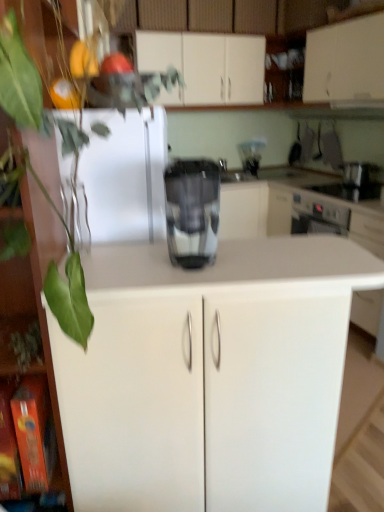
Describe the element at coordinates (40, 296) in the screenshot. I see `white matte cabinet at left, which is counted as the 1th cabinetry, starting from the front` at that location.

This screenshot has height=512, width=384. What are the coordinates of `green leafy plant at left` in the screenshot? It's located at (31, 93).

Describe the element at coordinates (251, 155) in the screenshot. The height and width of the screenshot is (512, 384). I see `metallic silver coffee maker at center` at that location.

How much space does metallic silver toaster at upper right, marked as the 2th appliance in a bottom-to-top arrangement, occupy vertically?

7.13 inches.

The width and height of the screenshot is (384, 512). In order to click on white matte cabinet at upper center, which is counted as the first cabinetry, starting from the back in this screenshot , I will do `click(205, 66)`.

Does metallic silver toaster at upper right, the 1th appliance in the top-to-bottom sequence, have a greater width compared to white matte cabinet at upper center, which is counted as the first cabinetry, starting from the back?

No.

From the image's perspective, which one is positioned higher, metallic silver toaster at upper right, marked as the 2th appliance in a bottom-to-top arrangement, or white matte cabinet at upper center, arranged as the fourth cabinetry when viewed from the front?

white matte cabinet at upper center, arranged as the fourth cabinetry when viewed from the front, appears higher in the image.

From a real-world perspective, is metallic silver toaster at upper right, marked as the 2th appliance in a bottom-to-top arrangement, positioned under white matte cabinet at upper center, which is counted as the first cabinetry, starting from the back, based on gravity?

Yes, from a real-world perspective, metallic silver toaster at upper right, marked as the 2th appliance in a bottom-to-top arrangement, is beneath white matte cabinet at upper center, which is counted as the first cabinetry, starting from the back.

Which object is positioned more to the right, metallic silver toaster at upper right, the 1th appliance in the top-to-bottom sequence, or white matte cabinet at upper center, which is counted as the first cabinetry, starting from the back?

metallic silver toaster at upper right, the 1th appliance in the top-to-bottom sequence, is more to the right.

Considering the relative positions of black glass stove at upper right, the 2th appliance when ordered from top to bottom, and white matte cabinet at left, which is counted as the 1th cabinetry, starting from the front, in the image provided, is black glass stove at upper right, the 2th appliance when ordered from top to bottom, to the right of white matte cabinet at left, which is counted as the 1th cabinetry, starting from the front, from the viewer's perspective?

Yes.

Can you confirm if black glass stove at upper right, the first appliance from the bottom, is wider than white matte cabinet at left, which is counted as the 1th cabinetry, starting from the front?

Yes.

Does point (355, 195) lie behind point (68, 492)?

Yes, it is behind point (68, 492).

What's the angular difference between black glass stove at upper right, the 2th appliance when ordered from top to bottom, and white matte cabinet at left, which is counted as the 1th cabinetry, starting from the front,'s facing directions?

They differ by 74.4 degrees in their facing directions.

In terms of size, does metallic silver coffee maker at center appear bigger or smaller than white matte cabinet at left, the fourth cabinetry positioned from the back?

Considering their sizes, metallic silver coffee maker at center takes up less space than white matte cabinet at left, the fourth cabinetry positioned from the back.

Considering the sizes of metallic silver coffee maker at center and white matte cabinet at left, the fourth cabinetry positioned from the back, in the image, is metallic silver coffee maker at center wider or thinner than white matte cabinet at left, the fourth cabinetry positioned from the back,?

Clearly, metallic silver coffee maker at center has less width compared to white matte cabinet at left, the fourth cabinetry positioned from the back.

Would you say metallic silver coffee maker at center contains white matte cabinet at left, which is counted as the 1th cabinetry, starting from the front?

Definitely not — white matte cabinet at left, which is counted as the 1th cabinetry, starting from the front, is not inside metallic silver coffee maker at center.

From a real-world perspective, does metallic silver coffee maker at center stand above white matte cabinet at left, the fourth cabinetry positioned from the back?

Yes, from a real-world perspective, metallic silver coffee maker at center is on top of white matte cabinet at left, the fourth cabinetry positioned from the back.

Relative to green leafy plant at left, is black glass stove at upper right, the 2th appliance when ordered from top to bottom, in front or behind?

Visually, black glass stove at upper right, the 2th appliance when ordered from top to bottom, is located behind green leafy plant at left.

Between black glass stove at upper right, the first appliance from the bottom, and green leafy plant at left, which one has smaller width?

green leafy plant at left.

Can you tell me how much metallic silver toaster at upper right, the 1th appliance in the top-to-bottom sequence, and white matte cabinet at upper center, which is counted as the second cabinetry, starting from the back, differ in facing direction?

The facing directions of metallic silver toaster at upper right, the 1th appliance in the top-to-bottom sequence, and white matte cabinet at upper center, which is counted as the second cabinetry, starting from the back, are 0.143 degrees apart.

From a real-world perspective, is metallic silver toaster at upper right, marked as the 2th appliance in a bottom-to-top arrangement, located beneath white matte cabinet at upper center, which is counted as the second cabinetry, starting from the back?

Yes, from a real-world perspective, metallic silver toaster at upper right, marked as the 2th appliance in a bottom-to-top arrangement, is below white matte cabinet at upper center, which is counted as the second cabinetry, starting from the back.

Is metallic silver toaster at upper right, the 1th appliance in the top-to-bottom sequence, wider or thinner than white matte cabinet at upper center, which is counted as the second cabinetry, starting from the back?

In the image, metallic silver toaster at upper right, the 1th appliance in the top-to-bottom sequence, appears to be more narrow than white matte cabinet at upper center, which is counted as the second cabinetry, starting from the back.

Considering the sizes of objects metallic silver toaster at upper right, marked as the 2th appliance in a bottom-to-top arrangement, and white matte cabinet at upper center, which is counted as the second cabinetry, starting from the back, in the image provided, who is shorter, metallic silver toaster at upper right, marked as the 2th appliance in a bottom-to-top arrangement, or white matte cabinet at upper center, which is counted as the second cabinetry, starting from the back,?

With less height is metallic silver toaster at upper right, marked as the 2th appliance in a bottom-to-top arrangement.

Which is closer to the camera, (198, 198) or (344, 199)?

Point (198, 198) is positioned closer to the camera compared to point (344, 199).

Find the location of a particular element. The height and width of the screenshot is (512, 384). home appliance that is below the black glass stove at upper right, the 2th appliance when ordered from top to bottom (from the image's perspective) is located at coordinates [192, 211].

In the scene shown: Do you think sleek metallic coffee maker at center is within black glass stove at upper right, the 2th appliance when ordered from top to bottom, or outside of it?

sleek metallic coffee maker at center lies outside black glass stove at upper right, the 2th appliance when ordered from top to bottom.

Is sleek metallic coffee maker at center bigger than black glass stove at upper right, the 2th appliance when ordered from top to bottom?

Actually, sleek metallic coffee maker at center might be smaller than black glass stove at upper right, the 2th appliance when ordered from top to bottom.

Does metallic silver coffee maker at center have a greater width compared to white matte cabinet at upper center, arranged as the fourth cabinetry when viewed from the front?

In fact, metallic silver coffee maker at center might be narrower than white matte cabinet at upper center, arranged as the fourth cabinetry when viewed from the front.

Which object is more forward, metallic silver coffee maker at center or white matte cabinet at upper center, arranged as the fourth cabinetry when viewed from the front?

white matte cabinet at upper center, arranged as the fourth cabinetry when viewed from the front, is more forward.

Which appliance is the 2nd one when counting from the right side of the white matte cabinet at upper center, arranged as the fourth cabinetry when viewed from the front? Please provide its 2D coordinates.

[(358, 173)]

Locate an element on the screen. The image size is (384, 512). cabinetry that is the 4th object to the left of the black glass stove at upper right, the first appliance from the bottom, starting at the anchor is located at coordinates (40, 296).

When comparing their distances from white matte cabinet at upper center, which is the 3th cabinetry in front-to-back order, does green leafy plant at left or metallic silver coffee maker at center seem further?

green leafy plant at left.

Considering their positions, is white matte cabinet at upper center, which is counted as the first cabinetry, starting from the back, positioned closer to metallic silver toaster at upper right, the 1th appliance in the top-to-bottom sequence, than white matte cabinet at left, the fourth cabinetry positioned from the back?

white matte cabinet at upper center, which is counted as the first cabinetry, starting from the back, is positioned closer to the anchor metallic silver toaster at upper right, the 1th appliance in the top-to-bottom sequence.

Looking at the image, which one is located further to sleek metallic coffee maker at center, white matte cabinet at upper center, which is the 3th cabinetry in front-to-back order, or white matte cabinet at upper center, arranged as the fourth cabinetry when viewed from the front?

white matte cabinet at upper center, arranged as the fourth cabinetry when viewed from the front.

From the image, which object appears to be farther from sleek metallic coffee maker at center, green leafy plant at left or black glass stove at upper right, the 2th appliance when ordered from top to bottom?

black glass stove at upper right, the 2th appliance when ordered from top to bottom, lies further to sleek metallic coffee maker at center than the other object.

Estimate the real-world distances between objects in this image. Which object is closer to white matte cabinet at upper center, which is the 3th cabinetry in front-to-back order, metallic silver coffee maker at center or white matte cabinet at center, positioned as the 2th cabinetry in front-to-back order?

metallic silver coffee maker at center is closer to white matte cabinet at upper center, which is the 3th cabinetry in front-to-back order.

Based on their spatial positions, is sleek metallic coffee maker at center or green leafy plant at left further from metallic silver coffee maker at center?

The object further to metallic silver coffee maker at center is green leafy plant at left.

Estimate the real-world distances between objects in this image. Which object is further from metallic silver coffee maker at center, white matte cabinet at center, positioned as the 2th cabinetry in front-to-back order, or sleek metallic coffee maker at center?

Among the two, white matte cabinet at center, positioned as the 2th cabinetry in front-to-back order, is located further to metallic silver coffee maker at center.

Estimate the real-world distances between objects in this image. Which object is further from metallic silver coffee maker at center, green leafy plant at left or sleek metallic coffee maker at center?

green leafy plant at left is further to metallic silver coffee maker at center.

Locate an element on the screen. The image size is (384, 512). appliance between white matte cabinet at left, which is counted as the 1th cabinetry, starting from the front, and white matte cabinet at upper center, which is counted as the first cabinetry, starting from the back, in the front-back direction is located at coordinates (x=349, y=191).

Identify the location of home appliance between white matte cabinet at left, the fourth cabinetry positioned from the back, and white matte cabinet at upper center, which is counted as the first cabinetry, starting from the back, in the front-back direction. Image resolution: width=384 pixels, height=512 pixels. (192, 211).

Locate an element on the screen. This screenshot has height=512, width=384. appliance between green leafy plant at left and metallic silver toaster at upper right, the 1th appliance in the top-to-bottom sequence, in the front-back direction is located at coordinates (349, 191).

Identify the location of appliance between white matte cabinet at center, the third cabinetry in the back-to-front sequence, and metallic silver toaster at upper right, marked as the 2th appliance in a bottom-to-top arrangement, along the z-axis. (349, 191).